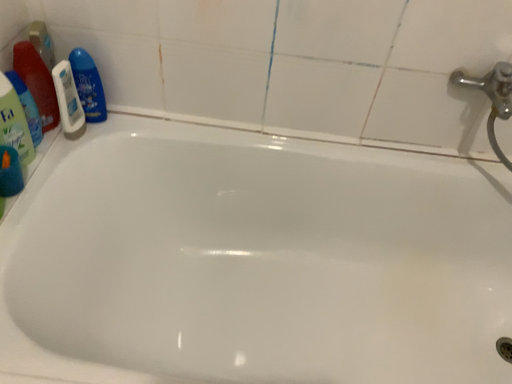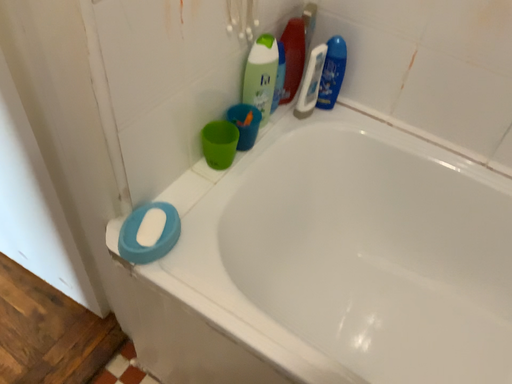
Question: Which way did the camera rotate in the video?

Choices:
 (A) rotated right
 (B) rotated left

Answer: (B)